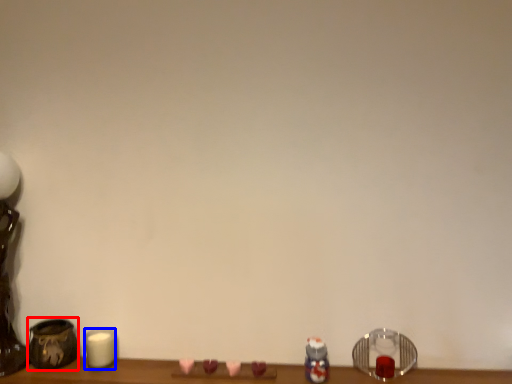
Question: Which point is further to the camera, pottery (highlighted by a red box) or candle (highlighted by a blue box)?

Choices:
 (A) pottery
 (B) candle

Answer: (B)